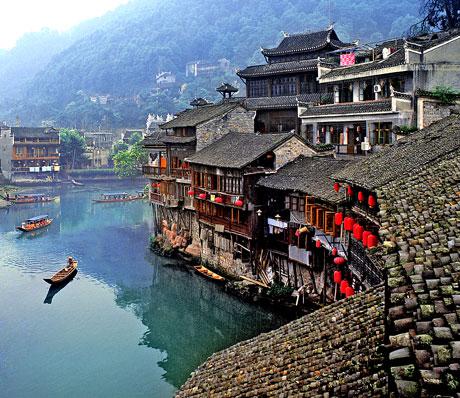
Where is `chimney`? Image resolution: width=460 pixels, height=398 pixels. chimney is located at coordinates (425, 115).